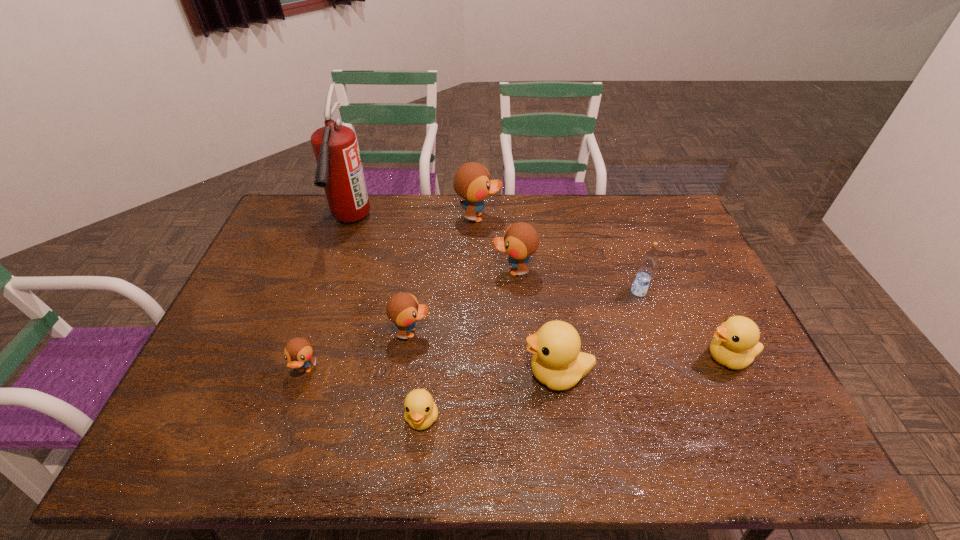
Find the location of `the tallest object`. the tallest object is located at coordinates (339, 171).

Find the location of a particular element. This screenshot has width=960, height=540. fire extinguisher is located at coordinates click(x=339, y=171).

I want to click on the biggest blue duck, so click(472, 182).

This screenshot has height=540, width=960. In order to click on the farthest duck in this screenshot , I will do `click(472, 182)`.

Where is `the eighth object from left to right`? the eighth object from left to right is located at coordinates (647, 265).

Locate an element on the screen. This screenshot has width=960, height=540. vodka is located at coordinates (647, 265).

You are a GUI agent. You are given a task and a screenshot of the screen. Output one action in this format:
    pyautogui.click(x=<x>, y=<y>)
    Task: Click on the second farthest duck
    
    Given the screenshot: What is the action you would take?
    pyautogui.click(x=520, y=241)

Where is `the second farthest blue duck`? The height and width of the screenshot is (540, 960). the second farthest blue duck is located at coordinates (520, 241).

The image size is (960, 540). I want to click on the second yellow duck from left to right, so click(557, 362).

Locate an element on the screen. This screenshot has height=540, width=960. the second smallest blue duck is located at coordinates (403, 309).